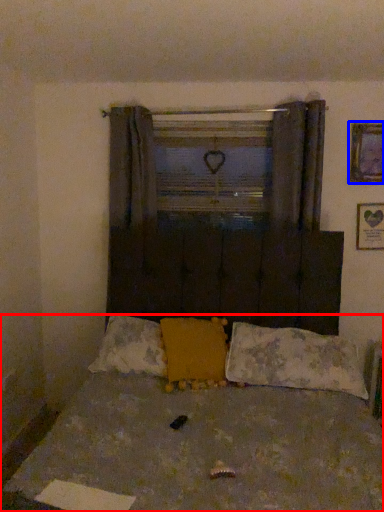
Question: Among these objects, which one is farthest to the camera, bed (highlighted by a red box) or picture frame (highlighted by a blue box)?

Choices:
 (A) bed
 (B) picture frame

Answer: (B)